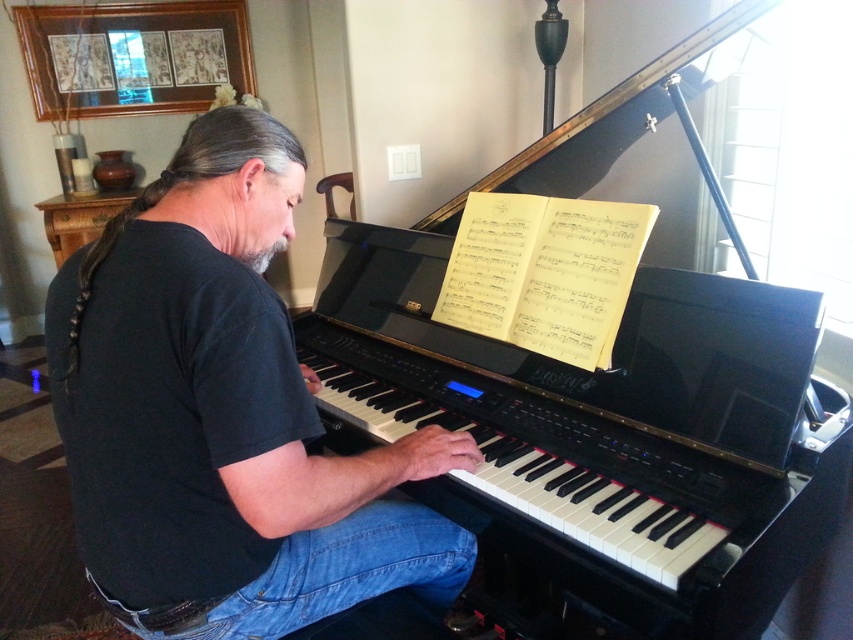
Consider the image. Is black glossy harpsichord at center to the right of black cotton shirt at center from the viewer's perspective?

Correct, you'll find black glossy harpsichord at center to the right of black cotton shirt at center.

Is black glossy harpsichord at center positioned before black cotton shirt at center?

No.

Between point (572, 452) and point (138, 552), which one is positioned in front?

Point (138, 552) is more forward.

At what (x,y) coordinates should I click in order to perform the action: click on black glossy harpsichord at center. Please return your answer as a coordinate pair (x, y). The width and height of the screenshot is (853, 640). Looking at the image, I should click on (602, 397).